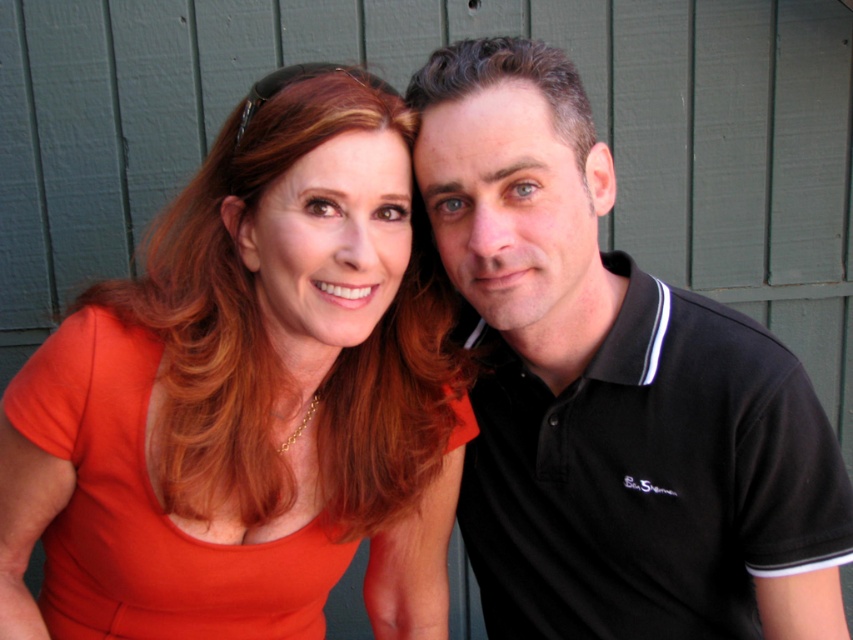
You are a photographer setting up a shoot. You need to place a prop between the orange matte dress at center and the black cotton polo shirt at right. Based on their positions, where should you place the prop so it is between them?

The orange matte dress at center is located below the black cotton polo shirt at right, so the prop should be placed between them vertically. Position it above the orange matte dress at center and below the black cotton polo shirt at right to ensure it is between them.

You are trying to decide which clothing item takes up more horizontal space in the image. Based on the scene, which one is wider between the orange matte dress at center and the black cotton polo shirt at right?

The orange matte dress at center is wider than the black cotton polo shirt at right according to the description.

You are a photographer trying to capture a group photo of two people standing side by side. The orange matte dress at center and the black cotton polo shirt at right are currently positioned 9.57 inches apart. If you want them to stand shoulder to shoulder with a gap of at least 12 inches between them, should they move closer together or farther apart?

The current distance between the orange matte dress at center and the black cotton polo shirt at right is 9.57 inches. To achieve a gap of at least 12 inches, they need to move farther apart to increase the distance between them.